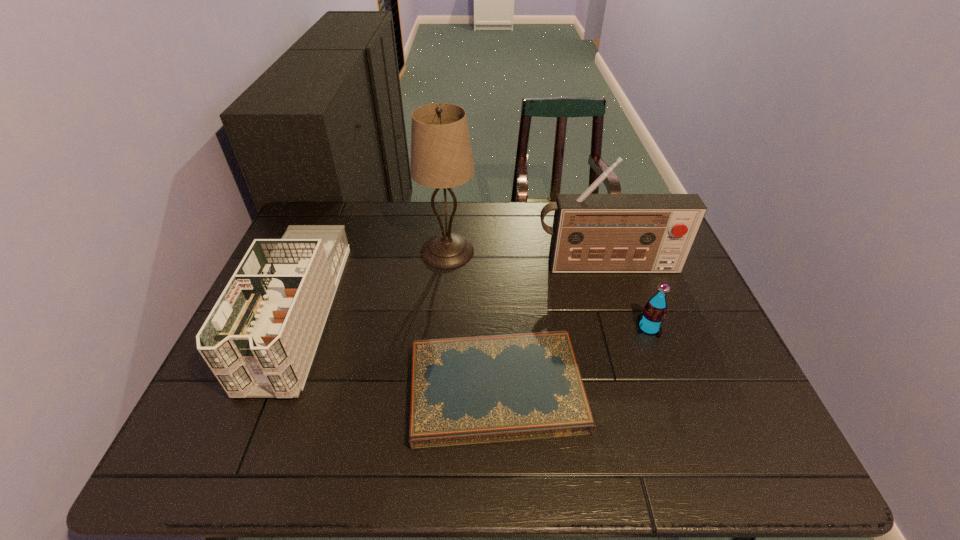
Where is `free spot located 0.190m on the back of the paperback book`? The height and width of the screenshot is (540, 960). free spot located 0.190m on the back of the paperback book is located at coordinates (493, 287).

Identify the location of object present at the far edge. This screenshot has width=960, height=540. (441, 157).

At what (x,y) coordinates should I click in order to perform the action: click on object that is at the near edge. Please return your answer as a coordinate pair (x, y). The width and height of the screenshot is (960, 540). Looking at the image, I should click on (475, 390).

Identify the location of object that is at the left edge. (259, 340).

Identify the location of radio receiver located at the right edge. (592, 233).

Locate an element on the screen. This screenshot has width=960, height=540. soda that is at the right edge is located at coordinates (650, 320).

The width and height of the screenshot is (960, 540). Identify the location of vacant region at the far edge. (495, 223).

The width and height of the screenshot is (960, 540). I want to click on free space at the near edge of the desktop, so click(x=556, y=440).

At what (x,y) coordinates should I click in order to perform the action: click on vacant point at the left edge. Please return your answer as a coordinate pair (x, y). Looking at the image, I should click on (242, 400).

At what (x,y) coordinates should I click in order to perform the action: click on vacant space at the right edge of the desktop. Please return your answer as a coordinate pair (x, y). The image size is (960, 540). Looking at the image, I should click on (727, 346).